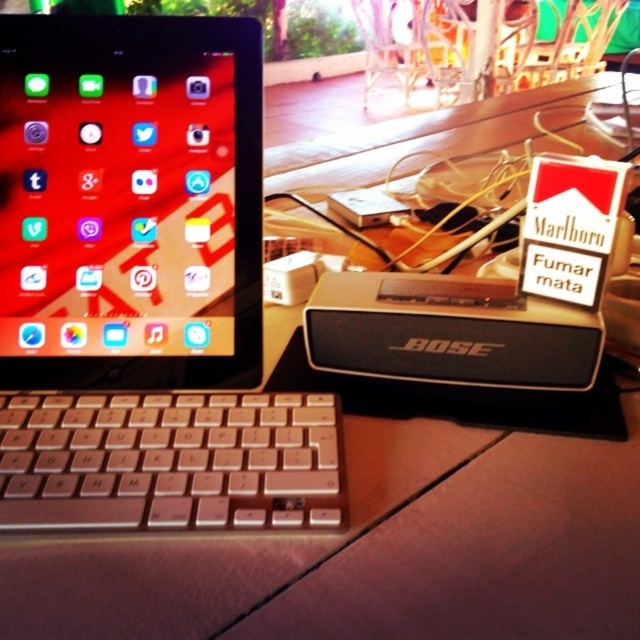
Question: Which of the following is the farthest from the observer?

Choices:
 (A) silver metallic keyboard at lower left
 (B) silver metallic laptop at left

Answer: (B)

Question: Which object appears closest to the camera in this image?

Choices:
 (A) silver metallic keyboard at lower left
 (B) silver metallic laptop at left

Answer: (A)

Question: Observing the image, what is the correct spatial positioning of silver metallic laptop at left in reference to silver metallic keyboard at lower left?

Choices:
 (A) below
 (B) above

Answer: (B)

Question: Can you confirm if silver metallic laptop at left is smaller than silver metallic keyboard at lower left?

Choices:
 (A) no
 (B) yes

Answer: (A)

Question: In this image, where is silver metallic laptop at left located relative to silver metallic keyboard at lower left?

Choices:
 (A) below
 (B) above

Answer: (B)